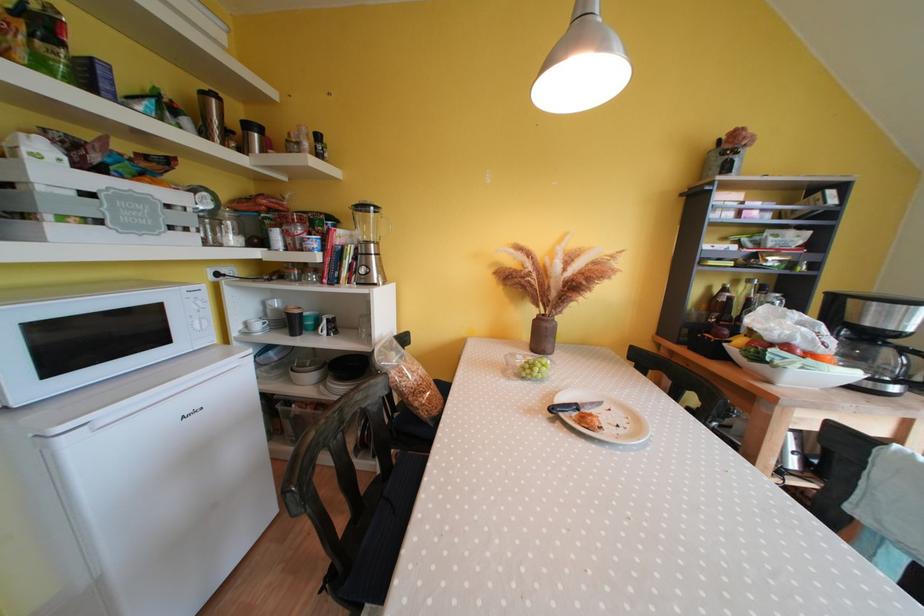
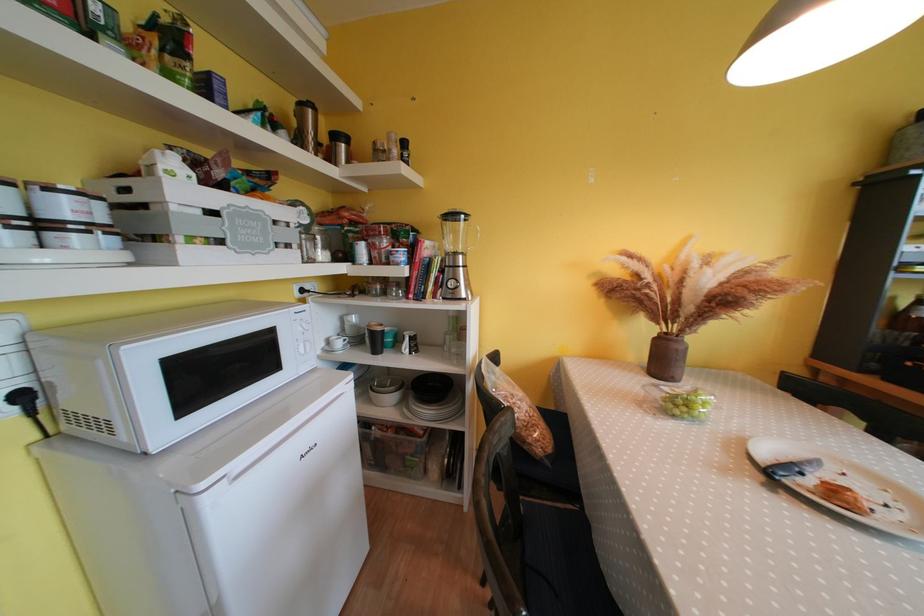
Locate, in the second image, the point that corresponds to (x=264, y=330) in the first image.

(345, 347)